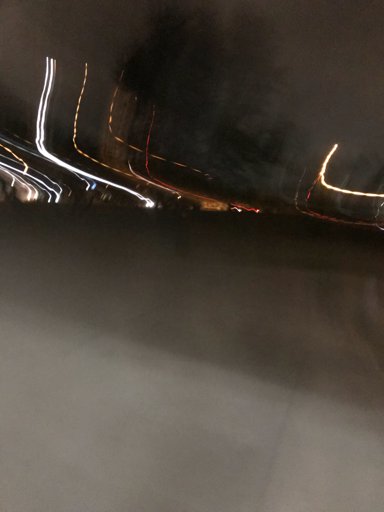
Locate an element on the screen. The width and height of the screenshot is (384, 512). orange light is located at coordinates (110, 130), (207, 203).